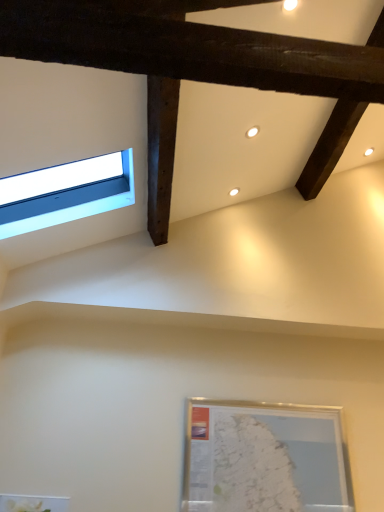
At what (x,y) coordinates should I click in order to perform the action: click on blue glass window at upper left. Please return your answer as a coordinate pair (x, y). Looking at the image, I should click on (65, 193).

What do you see at coordinates (65, 193) in the screenshot? The height and width of the screenshot is (512, 384). I see `blue glass window at upper left` at bounding box center [65, 193].

Where is `silver metallic picture frame at lower right`? silver metallic picture frame at lower right is located at coordinates (264, 458).

The height and width of the screenshot is (512, 384). What do you see at coordinates (264, 458) in the screenshot? I see `silver metallic picture frame at lower right` at bounding box center [264, 458].

Where is `blue glass window at upper left`? blue glass window at upper left is located at coordinates [x=65, y=193].

Considering the relative positions of blue glass window at upper left and silver metallic picture frame at lower right in the image provided, is blue glass window at upper left to the right of silver metallic picture frame at lower right from the viewer's perspective?

No, blue glass window at upper left is not to the right of silver metallic picture frame at lower right.

Looking at this image, which object is closer to the camera, blue glass window at upper left or silver metallic picture frame at lower right?

Positioned in front is blue glass window at upper left.

Considering the points (98, 174) and (236, 437), which point is in front, point (98, 174) or point (236, 437)?

The point (236, 437) is closer.

From the image's perspective, is blue glass window at upper left positioned above or below silver metallic picture frame at lower right?

blue glass window at upper left is above silver metallic picture frame at lower right.

From the picture: From a real-world perspective, is blue glass window at upper left above or below silver metallic picture frame at lower right?

From a real-world perspective, blue glass window at upper left is physically above silver metallic picture frame at lower right.

Looking at their sizes, would you say blue glass window at upper left is wider or thinner than silver metallic picture frame at lower right?

Considering their sizes, blue glass window at upper left looks broader than silver metallic picture frame at lower right.

Who is taller, blue glass window at upper left or silver metallic picture frame at lower right?

With more height is silver metallic picture frame at lower right.

Can you confirm if blue glass window at upper left is bigger than silver metallic picture frame at lower right?

Correct, blue glass window at upper left is larger in size than silver metallic picture frame at lower right.

Does blue glass window at upper left contain silver metallic picture frame at lower right?

No, silver metallic picture frame at lower right is not a part of blue glass window at upper left.

Are blue glass window at upper left and silver metallic picture frame at lower right far apart?

Yes, blue glass window at upper left is far from silver metallic picture frame at lower right.

Does blue glass window at upper left turn towards silver metallic picture frame at lower right?

No, blue glass window at upper left is not aimed at silver metallic picture frame at lower right.

Measure the distance between blue glass window at upper left and silver metallic picture frame at lower right.

blue glass window at upper left and silver metallic picture frame at lower right are 5.78 feet apart.

Image resolution: width=384 pixels, height=512 pixels. What are the coordinates of `window that appears on the left of silver metallic picture frame at lower right` in the screenshot? It's located at (65, 193).

Visually, is silver metallic picture frame at lower right positioned to the left or to the right of blue glass window at upper left?

Based on their positions, silver metallic picture frame at lower right is located to the right of blue glass window at upper left.

Is silver metallic picture frame at lower right in front of or behind blue glass window at upper left in the image?

In the image, silver metallic picture frame at lower right appears behind blue glass window at upper left.

Does point (252, 447) come in front of point (35, 173)?

No, it is not.

From the image's perspective, would you say silver metallic picture frame at lower right is positioned over blue glass window at upper left?

Incorrect, from the image's perspective, silver metallic picture frame at lower right is lower than blue glass window at upper left.

From a real-world perspective, is silver metallic picture frame at lower right above or below blue glass window at upper left?

In terms of real-world spatial position, silver metallic picture frame at lower right is below blue glass window at upper left.

Can you confirm if silver metallic picture frame at lower right is wider than blue glass window at upper left?

No, silver metallic picture frame at lower right is not wider than blue glass window at upper left.

Who is shorter, silver metallic picture frame at lower right or blue glass window at upper left?

blue glass window at upper left is shorter.

Between silver metallic picture frame at lower right and blue glass window at upper left, which one has larger size?

blue glass window at upper left.

Is silver metallic picture frame at lower right inside the boundaries of blue glass window at upper left, or outside?

silver metallic picture frame at lower right is outside blue glass window at upper left.

Is silver metallic picture frame at lower right with blue glass window at upper left?

No.

Is silver metallic picture frame at lower right oriented towards blue glass window at upper left?

No, silver metallic picture frame at lower right does not turn towards blue glass window at upper left.

Can you tell me how much silver metallic picture frame at lower right and blue glass window at upper left differ in facing direction?

The angle between the facing direction of silver metallic picture frame at lower right and the facing direction of blue glass window at upper left is 88.4 degrees.

Could you measure the distance between silver metallic picture frame at lower right and blue glass window at upper left?

silver metallic picture frame at lower right and blue glass window at upper left are 1.76 meters apart.

The height and width of the screenshot is (512, 384). In order to click on picture frame behind the blue glass window at upper left in this screenshot , I will do `click(264, 458)`.

Identify the location of window that appears in front of the silver metallic picture frame at lower right. (65, 193).

At what (x,y) coordinates should I click in order to perform the action: click on picture frame on the right of blue glass window at upper left. Please return your answer as a coordinate pair (x, y). This screenshot has width=384, height=512. Looking at the image, I should click on (264, 458).